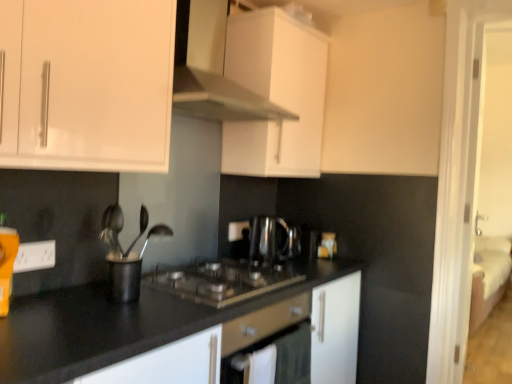
Locate an element on the screen. vacant area that is in front of satin black coffee machine at center is located at coordinates (261, 273).